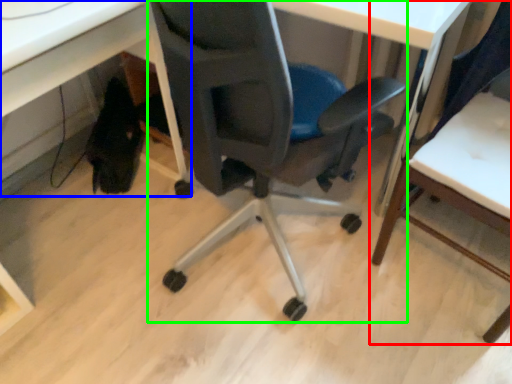
Question: Based on their relative distances, which object is nearer to chair (highlighted by a red box)? Choose from computer desk (highlighted by a blue box) and chair (highlighted by a green box).

Choices:
 (A) computer desk
 (B) chair

Answer: (B)